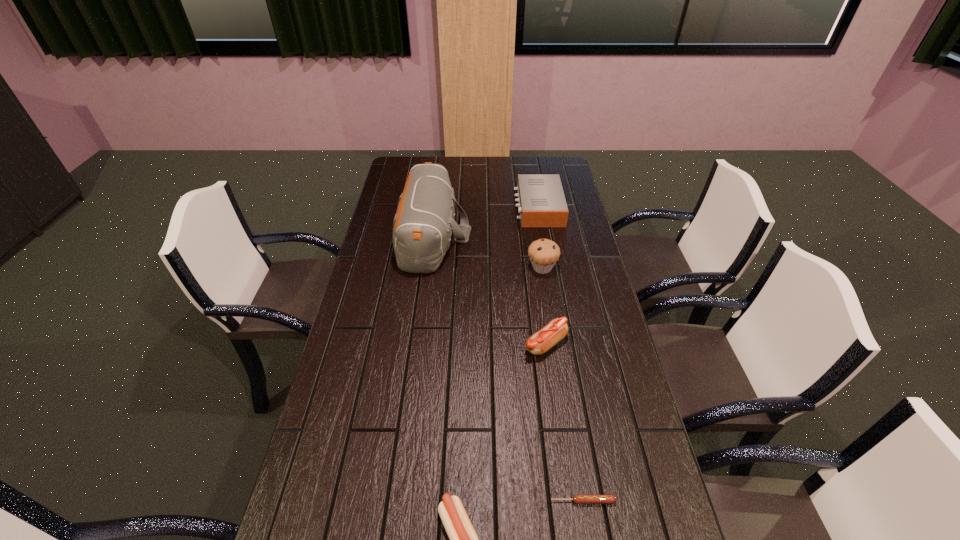
Where is `sausage that stands as the second closest to the tallest object`? The height and width of the screenshot is (540, 960). sausage that stands as the second closest to the tallest object is located at coordinates (463, 539).

The width and height of the screenshot is (960, 540). I want to click on vacant space that satisfies the following two spatial constraints: 1. on the front side of the shortest object; 2. on the left side of the tallest sausage, so click(567, 501).

What are the coordinates of `vacant space that satisfies the following two spatial constraints: 1. on the front side of the farthest sausage; 2. on the left side of the shortest sausage` in the screenshot? It's located at (567, 501).